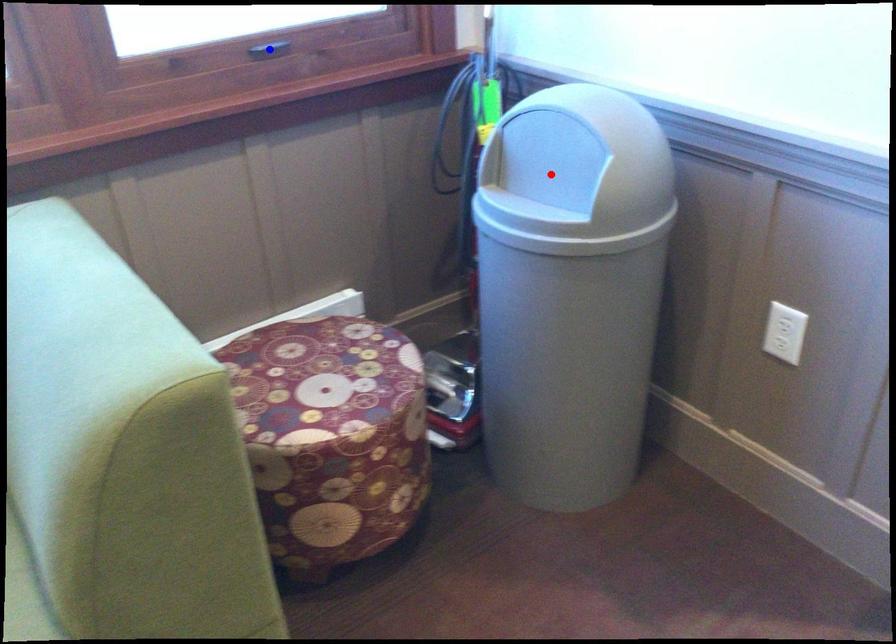
Question: In the image, two points are highlighted. Which point is nearer to the camera? Reply with the corresponding letter.

Choices:
 (A) blue point
 (B) red point

Answer: (B)